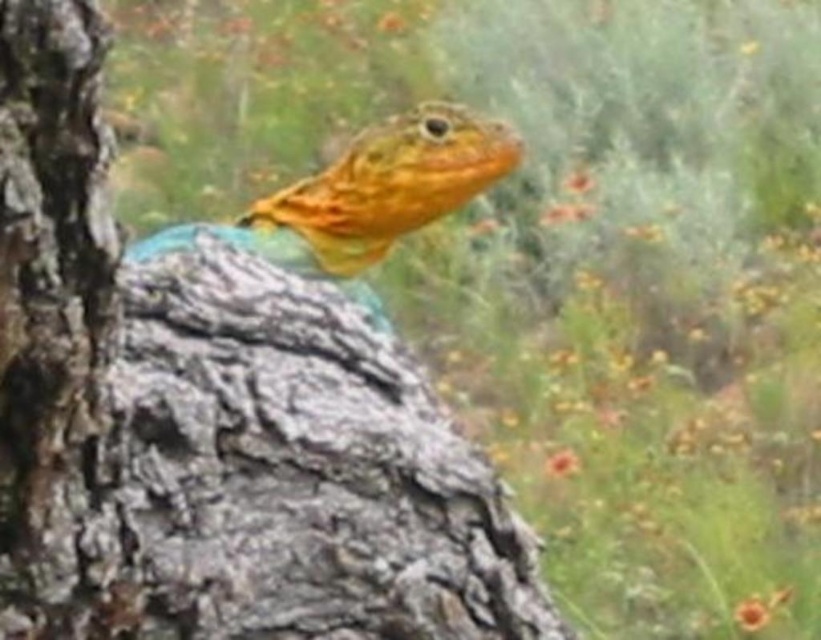
You are a photographer holding a camera that requires you to be at least 30 inches away from your subject to focus properly. You want to take a photo of the smooth bark tree trunk at center. Based on the scene description, can you take the photo without moving closer than your camera requires?

The smooth bark tree trunk at center and viewer are 29.67 inches apart from each other. Since the required distance is 30 inches, the photographer cannot take the photo without moving closer than the camera requires.

You are a photographer aiming to capture the lizard on the tree trunk. The camera is positioned at point A, which is to the left of the smooth bark tree trunk at center. You want to adjust your position to the right of the smooth bark tree trunk at center to get a better angle. However, there is an obstacle at point B located at point coordinates (x=211, y=419). Can you move to the right of the smooth bark tree trunk at center without stepping on the obstacle at point B?

The obstacle at point B is located at point coordinates (x=211, y=419), which corresponds to the smooth bark tree trunk at center. Since you want to move to the right of the smooth bark tree trunk at center, you can do so without stepping on the obstacle because the obstacle is exactly at the center point of the tree trunk, not to the right of it.

You are a photographer trying to capture a closeup of the shiny orange lizard at center. The smooth bark tree trunk at center is blocking your view. Can you move the trunk to get a clear shot? Explain why or why not based on their positions.

The smooth bark tree trunk at center is 14.08 inches away from the shiny orange lizard at center. Since the trunk is part of the tree and cannot be moved, you cannot move it to get a clear shot. You might need to adjust your position or use a different angle to capture the lizard without obstruction.